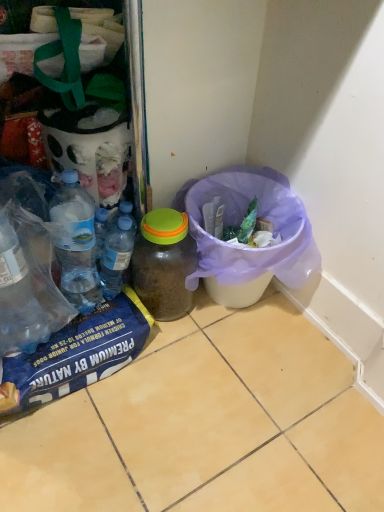
Describe the element at coordinates (164, 263) in the screenshot. The image size is (384, 512). I see `translucent plastic jar at center, acting as the first bottle starting from the right` at that location.

What do you see at coordinates (245, 245) in the screenshot?
I see `purple fabric bag at lower right` at bounding box center [245, 245].

Describe the element at coordinates (116, 256) in the screenshot. I see `translucent plastic bottles at center, which ranks as the 2th bottle in right-to-left order` at that location.

Identify the location of translucent plastic jar at center, acting as the first bottle starting from the right. [x=164, y=263].

Does translucent plastic bottles at center, which ranks as the first bottle in left-to-right order, turn towards purple fabric bag at lower right?

No, translucent plastic bottles at center, which ranks as the first bottle in left-to-right order, is not turned towards purple fabric bag at lower right.

Can we say translucent plastic bottles at center, which ranks as the 2th bottle in right-to-left order, lies outside purple fabric bag at lower right?

Absolutely, translucent plastic bottles at center, which ranks as the 2th bottle in right-to-left order, is external to purple fabric bag at lower right.

From the picture: Is translucent plastic bottles at center, which ranks as the 2th bottle in right-to-left order, next to purple fabric bag at lower right?

No, translucent plastic bottles at center, which ranks as the 2th bottle in right-to-left order, is not next to purple fabric bag at lower right.

Is the position of translucent plastic jar at center, acting as the first bottle starting from the right, less distant than that of translucent plastic bottles at center, which ranks as the first bottle in left-to-right order?

Yes, it is.

Where is `bottle located underneath the translucent plastic bottles at center, which ranks as the 2th bottle in right-to-left order (from a real-world perspective)`? The width and height of the screenshot is (384, 512). bottle located underneath the translucent plastic bottles at center, which ranks as the 2th bottle in right-to-left order (from a real-world perspective) is located at coordinates (164, 263).

Considering the sizes of objects translucent plastic jar at center, positioned as the 2th bottle in left-to-right order, and translucent plastic bottles at center, which ranks as the first bottle in left-to-right order, in the image provided, who is thinner, translucent plastic jar at center, positioned as the 2th bottle in left-to-right order, or translucent plastic bottles at center, which ranks as the first bottle in left-to-right order,?

With smaller width is translucent plastic bottles at center, which ranks as the first bottle in left-to-right order.

Between translucent plastic jar at center, acting as the first bottle starting from the right, and translucent plastic bottles at center, which ranks as the first bottle in left-to-right order, which one has larger size?

Bigger between the two is translucent plastic jar at center, acting as the first bottle starting from the right.

Which of these two, purple fabric bag at lower right or translucent plastic bottles at center, which ranks as the 2th bottle in right-to-left order, is bigger?

purple fabric bag at lower right is bigger.

From a real-world perspective, which object rests below the other?

purple fabric bag at lower right.

Can you see purple fabric bag at lower right touching translucent plastic bottles at center, which ranks as the 2th bottle in right-to-left order?

No, purple fabric bag at lower right is not next to translucent plastic bottles at center, which ranks as the 2th bottle in right-to-left order.

Is translucent plastic jar at center, positioned as the 2th bottle in left-to-right order, at the right side of purple fabric bag at lower right?

No.

Would you consider translucent plastic jar at center, positioned as the 2th bottle in left-to-right order, to be distant from purple fabric bag at lower right?

That's not correct — translucent plastic jar at center, positioned as the 2th bottle in left-to-right order, is a little close to purple fabric bag at lower right.

Is translucent plastic jar at center, acting as the first bottle starting from the right, looking in the opposite direction of purple fabric bag at lower right?

translucent plastic jar at center, acting as the first bottle starting from the right, does not have its back to purple fabric bag at lower right.

From the image's perspective, is translucent plastic jar at center, positioned as the 2th bottle in left-to-right order, under purple fabric bag at lower right?

Yes.

Is purple fabric bag at lower right not close to translucent plastic jar at center, positioned as the 2th bottle in left-to-right order?

Actually, purple fabric bag at lower right and translucent plastic jar at center, positioned as the 2th bottle in left-to-right order, are a little close together.

In the image, is purple fabric bag at lower right on the left side or the right side of translucent plastic jar at center, acting as the first bottle starting from the right?

Clearly, purple fabric bag at lower right is on the right of translucent plastic jar at center, acting as the first bottle starting from the right, in the image.

Between point (236, 257) and point (167, 307), which one is positioned in front?

Positioned in front is point (236, 257).

Considering the sizes of objects purple fabric bag at lower right and translucent plastic jar at center, positioned as the 2th bottle in left-to-right order, in the image provided, who is shorter, purple fabric bag at lower right or translucent plastic jar at center, positioned as the 2th bottle in left-to-right order,?

translucent plastic jar at center, positioned as the 2th bottle in left-to-right order, is shorter.

Would you say translucent plastic bottles at center, which ranks as the first bottle in left-to-right order, is inside or outside translucent plastic jar at center, positioned as the 2th bottle in left-to-right order?

translucent plastic bottles at center, which ranks as the first bottle in left-to-right order, is outside translucent plastic jar at center, positioned as the 2th bottle in left-to-right order.

From a real-world perspective, is translucent plastic bottles at center, which ranks as the 2th bottle in right-to-left order, physically located above or below translucent plastic jar at center, acting as the first bottle starting from the right?

Clearly, from a real-world perspective, translucent plastic bottles at center, which ranks as the 2th bottle in right-to-left order, is above translucent plastic jar at center, acting as the first bottle starting from the right.

What's the angular difference between translucent plastic bottles at center, which ranks as the 2th bottle in right-to-left order, and translucent plastic jar at center, acting as the first bottle starting from the right,'s facing directions?

1.74 degrees separate the facing orientations of translucent plastic bottles at center, which ranks as the 2th bottle in right-to-left order, and translucent plastic jar at center, acting as the first bottle starting from the right.

Considering the relative sizes of translucent plastic bottles at center, which ranks as the 2th bottle in right-to-left order, and translucent plastic jar at center, acting as the first bottle starting from the right, in the image provided, is translucent plastic bottles at center, which ranks as the 2th bottle in right-to-left order, thinner than translucent plastic jar at center, acting as the first bottle starting from the right,?

Indeed, translucent plastic bottles at center, which ranks as the 2th bottle in right-to-left order, has a lesser width compared to translucent plastic jar at center, acting as the first bottle starting from the right.

At what (x,y) coordinates should I click in order to perform the action: click on recycling bin below the translucent plastic bottles at center, which ranks as the 2th bottle in right-to-left order (from a real-world perspective). Please return your answer as a coordinate pair (x, y). This screenshot has height=512, width=384. Looking at the image, I should click on (245, 245).

Where is `bottle on the left of translucent plastic jar at center, acting as the first bottle starting from the right`? The width and height of the screenshot is (384, 512). bottle on the left of translucent plastic jar at center, acting as the first bottle starting from the right is located at coordinates (116, 256).

Based on the photo, looking at the image, which one is located closer to purple fabric bag at lower right, translucent plastic jar at center, positioned as the 2th bottle in left-to-right order, or translucent plastic bottles at center, which ranks as the 2th bottle in right-to-left order?

translucent plastic jar at center, positioned as the 2th bottle in left-to-right order, is closer to purple fabric bag at lower right.

Looking at the image, which one is located further to translucent plastic jar at center, acting as the first bottle starting from the right, translucent plastic bottles at center, which ranks as the 2th bottle in right-to-left order, or purple fabric bag at lower right?

The object further to translucent plastic jar at center, acting as the first bottle starting from the right, is purple fabric bag at lower right.

From the picture: Considering their positions, is translucent plastic bottles at center, which ranks as the first bottle in left-to-right order, positioned further to purple fabric bag at lower right than translucent plastic jar at center, acting as the first bottle starting from the right?

The object further to purple fabric bag at lower right is translucent plastic bottles at center, which ranks as the first bottle in left-to-right order.

When comparing their distances from translucent plastic jar at center, positioned as the 2th bottle in left-to-right order, does purple fabric bag at lower right or translucent plastic bottles at center, which ranks as the first bottle in left-to-right order, seem further?

purple fabric bag at lower right lies further to translucent plastic jar at center, positioned as the 2th bottle in left-to-right order, than the other object.

When comparing their distances from translucent plastic bottles at center, which ranks as the first bottle in left-to-right order, does purple fabric bag at lower right or translucent plastic jar at center, acting as the first bottle starting from the right, seem closer?

The object closer to translucent plastic bottles at center, which ranks as the first bottle in left-to-right order, is translucent plastic jar at center, acting as the first bottle starting from the right.

Considering their positions, is translucent plastic jar at center, positioned as the 2th bottle in left-to-right order, positioned closer to translucent plastic bottles at center, which ranks as the 2th bottle in right-to-left order, than purple fabric bag at lower right?

Among the two, translucent plastic jar at center, positioned as the 2th bottle in left-to-right order, is located nearer to translucent plastic bottles at center, which ranks as the 2th bottle in right-to-left order.

Locate an element on the screen. bottle located between translucent plastic bottles at center, which ranks as the first bottle in left-to-right order, and purple fabric bag at lower right in the left-right direction is located at coordinates (164, 263).